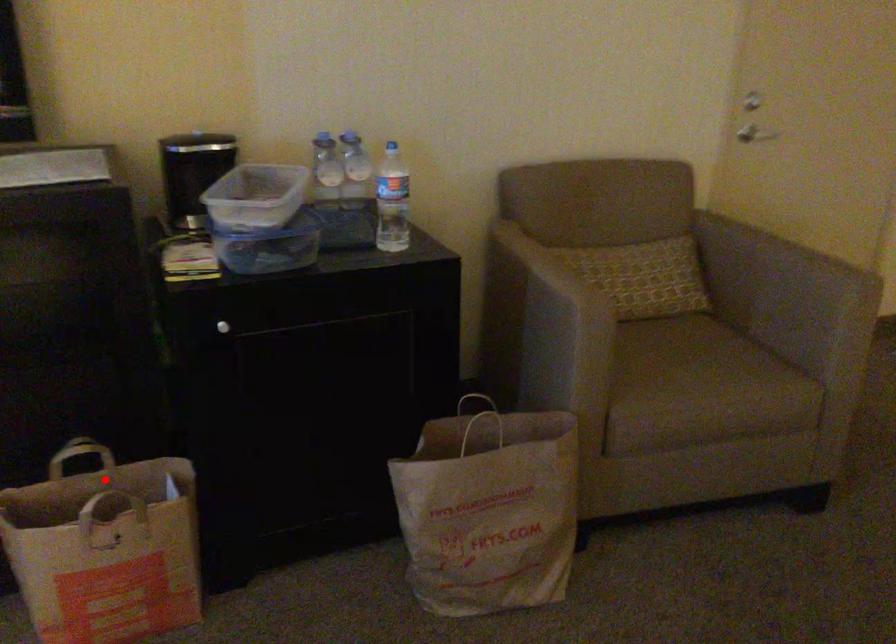
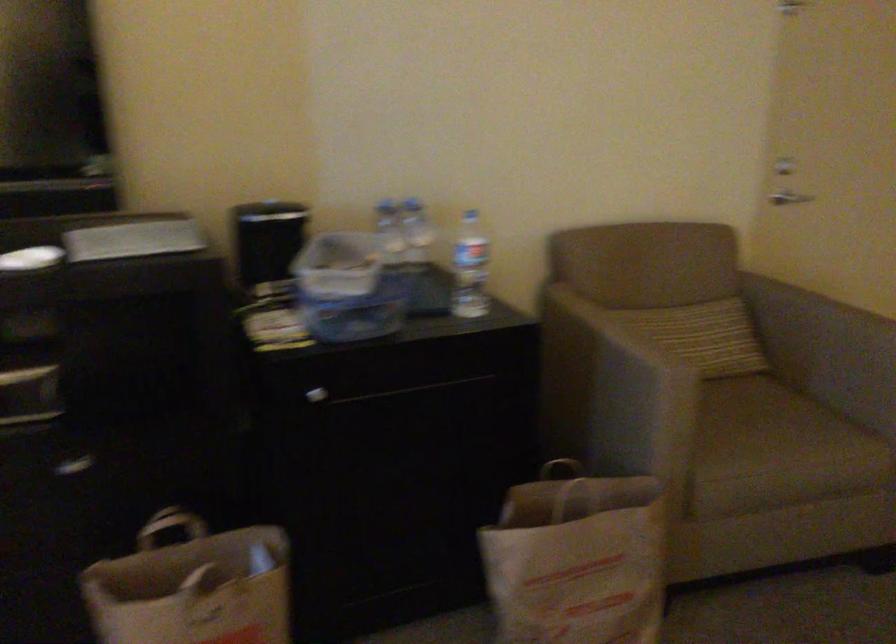
Where in the second image is the point corresponding to the highlighted location from the first image?

(192, 554)